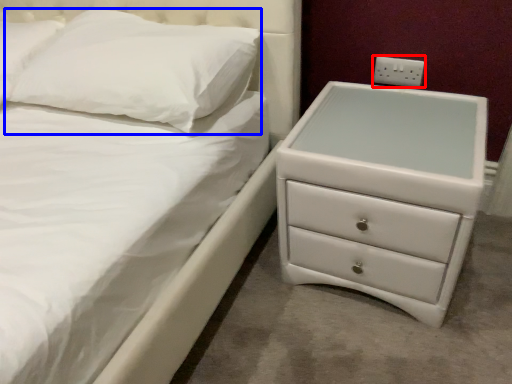
Question: Among these objects, which one is farthest to the camera, electric outlet (highlighted by a red box) or pillow (highlighted by a blue box)?

Choices:
 (A) electric outlet
 (B) pillow

Answer: (A)